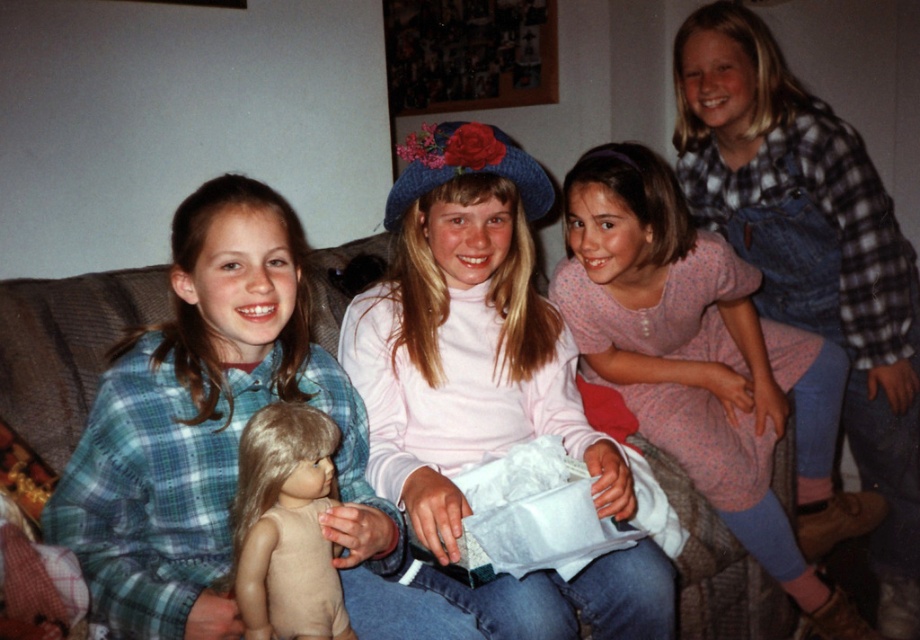
Is matte pink turtleneck at center to the left of smooth beige doll at center from the viewer's perspective?

No, matte pink turtleneck at center is not to the left of smooth beige doll at center.

Who is positioned more to the left, matte pink turtleneck at center or smooth beige doll at center?

smooth beige doll at center is more to the left.

Is point (429, 476) positioned after point (294, 545)?

Yes, it is.

Locate an element on the screen. matte pink turtleneck at center is located at coordinates (486, 385).

Does matte plaid shirt at left have a lesser width compared to smooth beige doll at center?

In fact, matte plaid shirt at left might be wider than smooth beige doll at center.

Does matte plaid shirt at left have a greater width compared to smooth beige doll at center?

Yes, matte plaid shirt at left is wider than smooth beige doll at center.

The image size is (920, 640). In order to click on matte plaid shirt at left in this screenshot , I will do `click(207, 424)`.

Can you confirm if matte pink turtleneck at center is smaller than matte plaid shirt at left?

Actually, matte pink turtleneck at center might be larger than matte plaid shirt at left.

Can you confirm if matte pink turtleneck at center is positioned to the right of matte plaid shirt at left?

Yes, matte pink turtleneck at center is to the right of matte plaid shirt at left.

The width and height of the screenshot is (920, 640). Find the location of `matte pink turtleneck at center`. matte pink turtleneck at center is located at coordinates [486, 385].

At what (x,y) coordinates should I click in order to perform the action: click on matte pink turtleneck at center. Please return your answer as a coordinate pair (x, y). This screenshot has width=920, height=640. Looking at the image, I should click on (486, 385).